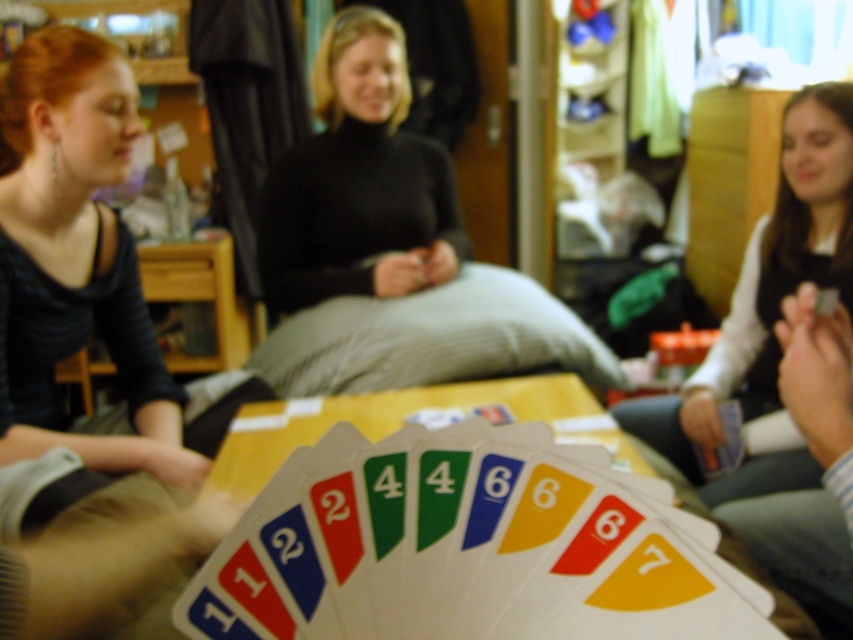
Which of these two, matte black shirt at left or black turtleneck sweater at center, stands shorter?

matte black shirt at left is shorter.

Is matte black shirt at left to the right of black turtleneck sweater at center from the viewer's perspective?

In fact, matte black shirt at left is to the left of black turtleneck sweater at center.

In order to click on matte black shirt at left in this screenshot , I will do `click(74, 257)`.

Who is lower down, smooth plastic cards at center or black turtleneck sweater at center?

smooth plastic cards at center is below.

Can you confirm if smooth plastic cards at center is positioned below black turtleneck sweater at center?

Yes.

Is point (381, 627) positioned behind point (451, 200)?

No, (381, 627) is closer to viewer.

This screenshot has height=640, width=853. Identify the location of smooth plastic cards at center. (465, 547).

Is smooth plastic cards at center behind matte black shirt at left?

No, smooth plastic cards at center is in front of matte black shirt at left.

Can you confirm if smooth plastic cards at center is positioned to the right of matte black shirt at left?

Yes, smooth plastic cards at center is to the right of matte black shirt at left.

Is point (326, 488) closer to viewer compared to point (105, 177)?

Yes, it is in front of point (105, 177).

This screenshot has height=640, width=853. I want to click on smooth plastic cards at center, so click(x=465, y=547).